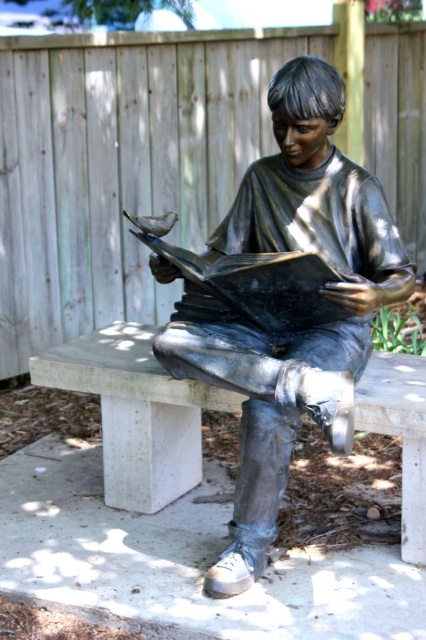
You are standing at the center of the image. There is a point at coordinates (284, 301). What object is located at that point?

A: The shiny bronze statue at center is located at point (284, 301).

You are a city planner assessing the space around the shiny bronze statue at center and the concrete bench at center. If you need to place a new flower bed that requires at least 2 meters of space around it, which object would you need to consider moving first?

The shiny bronze statue at center is bigger than the concrete bench at center, so you would need to consider moving the shiny bronze statue at center first because it occupies more space and would require more clearance for the flower bed.